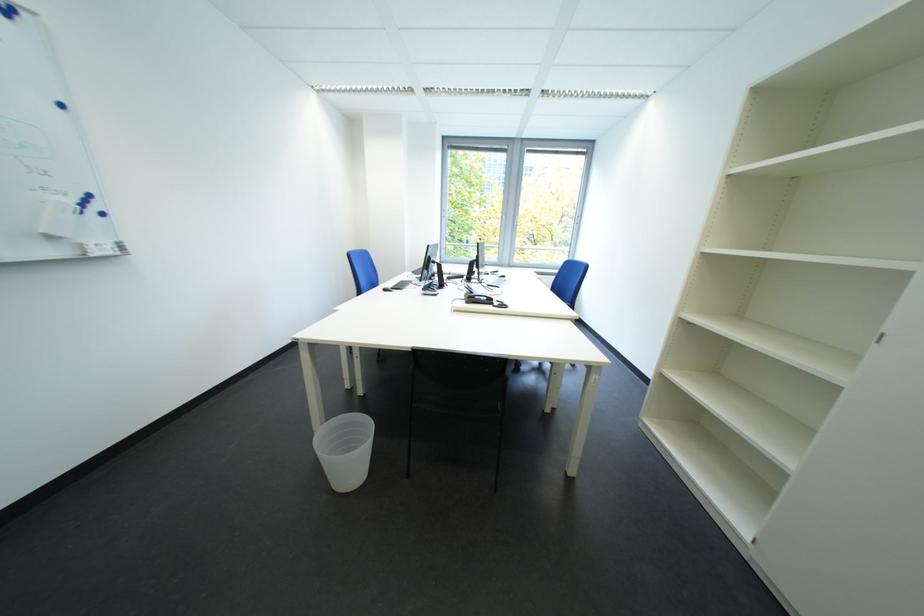
Find the location of `computer keyboard`. computer keyboard is located at coordinates (400, 284).